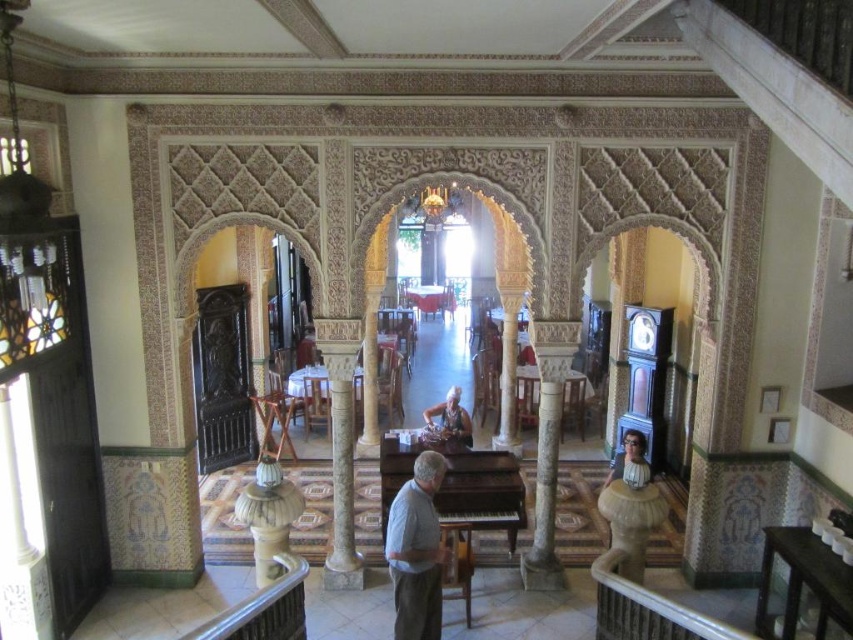
From the picture: You are a customer in this restaurant and you see two shirts, a gray cotton shirt at center and a matte gray shirt at lower right. Which shirt is located to the left of the other?

The gray cotton shirt at center is positioned on the left side of matte gray shirt at lower right.

You are a photographer setting up a shoot in this grand space. You need to place a small decorative item between the gray cotton shirt at center and the white marble pillar at center. Considering their sizes, which object should the item be closer to?

The gray cotton shirt at center has a smaller size compared to the white marble pillar at center, so the decorative item should be placed closer to the gray cotton shirt at center to maintain visual balance between the two objects.

You are a photographer setting up a shoot in this ornate space. You notice the gray cotton shirt at center and the matte brown hair at center. Which object is positioned lower in the scene?

The gray cotton shirt at center is located below matte brown hair at center, so the gray cotton shirt at center is positioned lower in the scene.